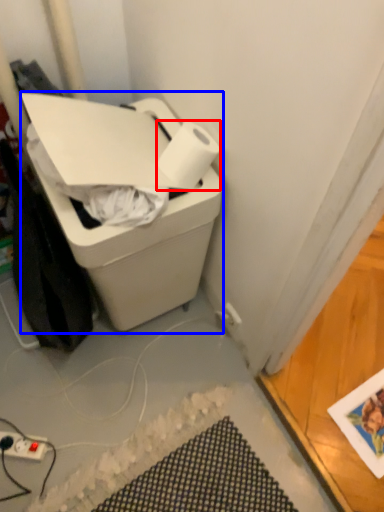
Question: Which object is closer to the camera taking this photo, paper towel (highlighted by a red box) or cardboard box (highlighted by a blue box)?

Choices:
 (A) paper towel
 (B) cardboard box

Answer: (B)